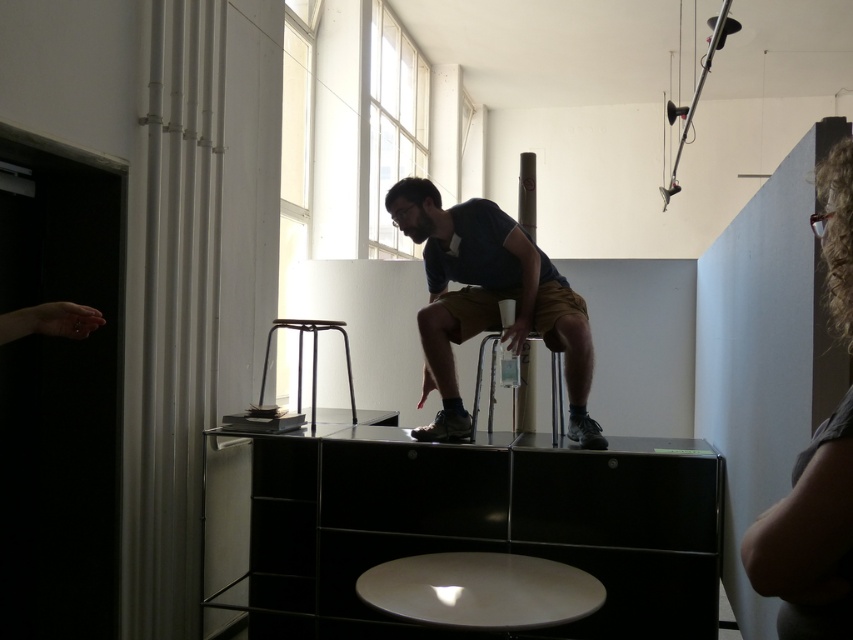
You are a photographer setting up a shoot in this studio. You need to position a camera to capture the matte blue shirt at center and the metallic silver bar stool at center. Which object should you focus on first if you want to ensure both are in sharp focus?

The matte blue shirt at center is closer to the viewer than the metallic silver bar stool at center. To ensure both are in sharp focus, focus on the matte blue shirt at center first, as it is closer, and adjust the camera settings for a deeper depth of field.

Based on the photo, you are a photographer in this studio and need to capture a candid shot of the man. Since the curly hair at upper right and the metallic black stool at lower center are in the frame, which object should you focus on to ensure the man is clearly visible?

You should focus on the curly hair at upper right because it is in front of the metallic black stool at lower center, making it closer to the camera and thus the man would be more clearly visible through the foreground object.

You are standing in the studio and notice the matte blue shirt at center and the metallic silver bar stool at center. Which object is positioned more to the right?

The metallic silver bar stool at center is positioned more to the right than the matte blue shirt at center.